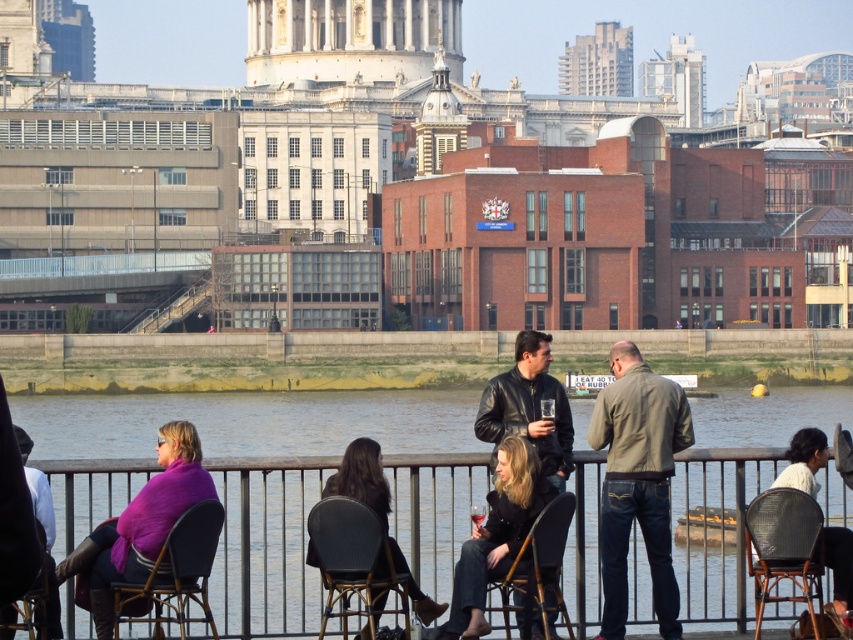
Question: From the image, what is the correct spatial relationship of rattan brown chair at lower right in relation to wooden chair at center?

Choices:
 (A) right
 (B) left

Answer: (A)

Question: Among these points, which one is nearest to the camera?

Choices:
 (A) (648, 385)
 (B) (341, 593)
 (C) (552, 476)
 (D) (575, 433)

Answer: (B)

Question: Which of these objects is positioned farthest from the white fabric jacket at lower right?

Choices:
 (A) rattan brown chair at lower right
 (B) black textured chair at center

Answer: (B)

Question: Which of the following is the farthest from the observer?

Choices:
 (A) white fabric jacket at lower right
 (B) rattan brown chair at lower right
 (C) matte brown jacket at center

Answer: (C)

Question: Can you confirm if matte brown jacket at center is smaller than rattan brown chair at lower right?

Choices:
 (A) yes
 (B) no

Answer: (B)

Question: Can you confirm if leather jacket at center is positioned below velvet purple cushion at lower left?

Choices:
 (A) yes
 (B) no

Answer: (B)